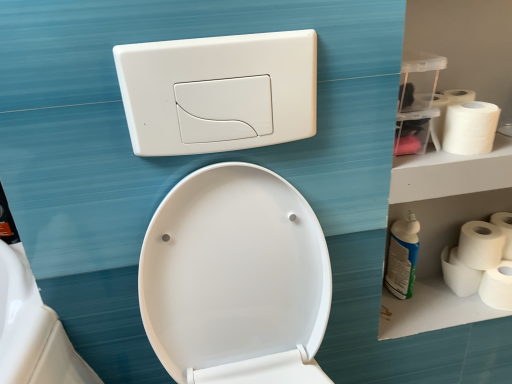
Identify the location of blue glossy spray bottle at right. The width and height of the screenshot is (512, 384). (402, 256).

This screenshot has width=512, height=384. Describe the element at coordinates (402, 256) in the screenshot. I see `blue glossy spray bottle at right` at that location.

Describe the element at coordinates (219, 92) in the screenshot. I see `white plastic flush plate at upper center` at that location.

Measure the distance between point (507, 238) and camera.

Point (507, 238) is 1.09 meters from camera.

The height and width of the screenshot is (384, 512). What do you see at coordinates (504, 231) in the screenshot? I see `white matte toilet paper at right, the 2th toilet paper viewed from the top` at bounding box center [504, 231].

In order to face white matte toilet paper at right, the first toilet paper in the bottom-to-top sequence, should I rotate leftwards or rightwards?

Turn right approximately 30.557 degrees to face it.

What do you see at coordinates (470, 128) in the screenshot?
I see `white matte toilet paper at right, positioned as the first toilet paper in top-to-bottom order` at bounding box center [470, 128].

Measure the distance between white matte toilet paper at right, the second toilet paper ordered from the bottom, and camera.

1.13 meters.

Identify the location of blue glossy spray bottle at right. (402, 256).

Is white plastic flush plate at upper center a part of white matte toilet paper at right, the first toilet paper in the bottom-to-top sequence?

No, white plastic flush plate at upper center is not inside white matte toilet paper at right, the first toilet paper in the bottom-to-top sequence.

From a real-world perspective, is white matte toilet paper at right, the first toilet paper in the bottom-to-top sequence, physically located above or below white plastic flush plate at upper center?

white matte toilet paper at right, the first toilet paper in the bottom-to-top sequence, is below white plastic flush plate at upper center.

Is white matte toilet paper at right, which ranks as the fifth toilet paper in top-to-bottom order, thinner than white plastic flush plate at upper center?

Incorrect, the width of white matte toilet paper at right, which ranks as the fifth toilet paper in top-to-bottom order, is not less than that of white plastic flush plate at upper center.

Which object is wider, blue glossy spray bottle at right or white matte toilet paper at right, positioned as the first toilet paper in top-to-bottom order?

white matte toilet paper at right, positioned as the first toilet paper in top-to-bottom order, is wider.

Considering the relative positions of blue glossy spray bottle at right and white matte toilet paper at right, positioned as the first toilet paper in top-to-bottom order, in the image provided, is blue glossy spray bottle at right to the left of white matte toilet paper at right, positioned as the first toilet paper in top-to-bottom order, from the viewer's perspective?

Yes.

Considering the sizes of objects blue glossy spray bottle at right and white matte toilet paper at right, positioned as the first toilet paper in top-to-bottom order, in the image provided, who is shorter, blue glossy spray bottle at right or white matte toilet paper at right, positioned as the first toilet paper in top-to-bottom order,?

Standing shorter between the two is white matte toilet paper at right, positioned as the first toilet paper in top-to-bottom order.

Does white matte toilet paper at right, which ranks as the fifth toilet paper in top-to-bottom order, have a smaller size compared to white matte toilet paper at right, placed as the third toilet paper when sorted from bottom to top?

Yes.

From the image's perspective, between white matte toilet paper at right, the first toilet paper in the bottom-to-top sequence, and white matte toilet paper at right, which appears as the third toilet paper when viewed from the top, who is located below?

white matte toilet paper at right, the first toilet paper in the bottom-to-top sequence.

How far apart are white matte toilet paper at right, which ranks as the fifth toilet paper in top-to-bottom order, and white matte toilet paper at right, which appears as the third toilet paper when viewed from the top?

A distance of 2.50 inches exists between white matte toilet paper at right, which ranks as the fifth toilet paper in top-to-bottom order, and white matte toilet paper at right, which appears as the third toilet paper when viewed from the top.

Can you tell me how much white matte toilet paper at right, the first toilet paper in the bottom-to-top sequence, and white matte toilet paper at right, which appears as the third toilet paper when viewed from the top, differ in facing direction?

0.000641 degrees separate the facing orientations of white matte toilet paper at right, the first toilet paper in the bottom-to-top sequence, and white matte toilet paper at right, which appears as the third toilet paper when viewed from the top.

Is blue glossy spray bottle at right far from white plastic flush plate at upper center?

They are positioned close to each other.

Looking at this image, what's the angular difference between blue glossy spray bottle at right and white plastic flush plate at upper center's facing directions?

blue glossy spray bottle at right and white plastic flush plate at upper center are facing 1.42 degrees away from each other.

Which is more to the right, blue glossy spray bottle at right or white plastic flush plate at upper center?

Positioned to the right is blue glossy spray bottle at right.

Relative to white plastic flush plate at upper center, is blue glossy spray bottle at right in front or behind?

blue glossy spray bottle at right is positioned farther from the viewer than white plastic flush plate at upper center.

Does white matte toilet paper at right, the 2th toilet paper viewed from the top, have a greater height compared to white matte toilet paper at right, positioned as the first toilet paper in top-to-bottom order?

Correct, white matte toilet paper at right, the 2th toilet paper viewed from the top, is much taller as white matte toilet paper at right, positioned as the first toilet paper in top-to-bottom order.

Can you confirm if white matte toilet paper at right, which is counted as the 4th toilet paper, starting from the bottom, is positioned to the right of white matte toilet paper at right, positioned as the fifth toilet paper in bottom-to-top order?

Correct, you'll find white matte toilet paper at right, which is counted as the 4th toilet paper, starting from the bottom, to the right of white matte toilet paper at right, positioned as the fifth toilet paper in bottom-to-top order.

From a real-world perspective, is white matte toilet paper at right, the 2th toilet paper viewed from the top, over white matte toilet paper at right, positioned as the first toilet paper in top-to-bottom order?

Actually, white matte toilet paper at right, the 2th toilet paper viewed from the top, is physically below white matte toilet paper at right, positioned as the first toilet paper in top-to-bottom order, in the real world.

Can you confirm if white matte toilet paper at right, which is counted as the 4th toilet paper, starting from the bottom, is smaller than white matte toilet paper at right, positioned as the first toilet paper in top-to-bottom order?

No.

Is white matte toilet paper at right, which is counted as the 4th toilet paper, starting from the bottom, located outside white matte toilet paper at right, which ranks as the fifth toilet paper in top-to-bottom order?

Indeed, white matte toilet paper at right, which is counted as the 4th toilet paper, starting from the bottom, is completely outside white matte toilet paper at right, which ranks as the fifth toilet paper in top-to-bottom order.

Is white matte toilet paper at right, which is counted as the 4th toilet paper, starting from the bottom, not near white matte toilet paper at right, which ranks as the fifth toilet paper in top-to-bottom order?

No, white matte toilet paper at right, which is counted as the 4th toilet paper, starting from the bottom, is not far from white matte toilet paper at right, which ranks as the fifth toilet paper in top-to-bottom order.

Considering the relative sizes of white matte toilet paper at right, which is counted as the 4th toilet paper, starting from the bottom, and white matte toilet paper at right, the first toilet paper in the bottom-to-top sequence, in the image provided, is white matte toilet paper at right, which is counted as the 4th toilet paper, starting from the bottom, thinner than white matte toilet paper at right, the first toilet paper in the bottom-to-top sequence,?

In fact, white matte toilet paper at right, which is counted as the 4th toilet paper, starting from the bottom, might be wider than white matte toilet paper at right, the first toilet paper in the bottom-to-top sequence.

Considering the relative sizes of white matte toilet paper at right, the 2th toilet paper viewed from the top, and white matte toilet paper at right, which ranks as the fifth toilet paper in top-to-bottom order, in the image provided, is white matte toilet paper at right, the 2th toilet paper viewed from the top, taller than white matte toilet paper at right, which ranks as the fifth toilet paper in top-to-bottom order,?

Yes, white matte toilet paper at right, the 2th toilet paper viewed from the top, is taller than white matte toilet paper at right, which ranks as the fifth toilet paper in top-to-bottom order.

Who is taller, white matte toilet paper at right, which appears as the third toilet paper when viewed from the top, or white matte toilet paper at right, which ranks as the fifth toilet paper in top-to-bottom order?

white matte toilet paper at right, which appears as the third toilet paper when viewed from the top.

From the picture: From the image's perspective, is white matte toilet paper at right, which appears as the third toilet paper when viewed from the top, located above or below white matte toilet paper at right, the first toilet paper in the bottom-to-top sequence?

Based on their image positions, white matte toilet paper at right, which appears as the third toilet paper when viewed from the top, is located above white matte toilet paper at right, the first toilet paper in the bottom-to-top sequence.

Would you say white matte toilet paper at right, which appears as the third toilet paper when viewed from the top, is outside white matte toilet paper at right, the first toilet paper in the bottom-to-top sequence?

That's correct, white matte toilet paper at right, which appears as the third toilet paper when viewed from the top, is outside of white matte toilet paper at right, the first toilet paper in the bottom-to-top sequence.

From the image's perspective, count 5th toilet papers downward from the white plastic flush plate at upper center and point to it. Please provide its 2D coordinates.

[(497, 286)]

The height and width of the screenshot is (384, 512). I want to click on toilet paper that appears in front of the blue glossy spray bottle at right, so click(x=470, y=128).

Looking at the image, which one is located closer to white matte toilet paper at right, which is counted as the 4th toilet paper, starting from the bottom, white matte toilet paper at right, which appears as the third toilet paper when viewed from the top, or white matte toilet paper at right, the second toilet paper ordered from the bottom?

white matte toilet paper at right, which appears as the third toilet paper when viewed from the top, lies closer to white matte toilet paper at right, which is counted as the 4th toilet paper, starting from the bottom, than the other object.

When comparing their distances from white matte toilet paper at right, which is counted as the 4th toilet paper, starting from the bottom, does white plastic flush plate at upper center or white matte toilet paper at right, positioned as the fifth toilet paper in bottom-to-top order, seem closer?

white matte toilet paper at right, positioned as the fifth toilet paper in bottom-to-top order.

Considering their positions, is white matte toilet paper at right, the first toilet paper in the bottom-to-top sequence, positioned closer to white matte toilet paper at right, which appears as the third toilet paper when viewed from the top, than white matte toilet paper at right, the second toilet paper ordered from the bottom?

The object closer to white matte toilet paper at right, which appears as the third toilet paper when viewed from the top, is white matte toilet paper at right, the second toilet paper ordered from the bottom.

Consider the image. Considering their positions, is white matte toilet paper at right, the 2th toilet paper viewed from the top, positioned closer to blue glossy spray bottle at right than white plastic flush plate at upper center?

white matte toilet paper at right, the 2th toilet paper viewed from the top, lies closer to blue glossy spray bottle at right than the other object.

In the scene shown: Considering their positions, is white matte toilet paper at right, arranged as the 4th toilet paper when viewed from the top, positioned further to blue glossy spray bottle at right than white matte toilet paper at right, the first toilet paper in the bottom-to-top sequence?

The object further to blue glossy spray bottle at right is white matte toilet paper at right, the first toilet paper in the bottom-to-top sequence.

Which object lies further to the anchor point white plastic flush plate at upper center, white matte toilet paper at right, arranged as the 4th toilet paper when viewed from the top, or white matte toilet paper at right, placed as the third toilet paper when sorted from bottom to top?

Among the two, white matte toilet paper at right, arranged as the 4th toilet paper when viewed from the top, is located further to white plastic flush plate at upper center.

Estimate the real-world distances between objects in this image. Which object is closer to white matte toilet paper at right, positioned as the fifth toilet paper in bottom-to-top order, white matte toilet paper at right, the 2th toilet paper viewed from the top, or white matte toilet paper at right, placed as the third toilet paper when sorted from bottom to top?

Among the two, white matte toilet paper at right, placed as the third toilet paper when sorted from bottom to top, is located nearer to white matte toilet paper at right, positioned as the fifth toilet paper in bottom-to-top order.

Estimate the real-world distances between objects in this image. Which object is closer to white matte toilet paper at right, placed as the third toilet paper when sorted from bottom to top, blue glossy spray bottle at right or white matte toilet paper at right, arranged as the 4th toilet paper when viewed from the top?

Based on the image, white matte toilet paper at right, arranged as the 4th toilet paper when viewed from the top, appears to be nearer to white matte toilet paper at right, placed as the third toilet paper when sorted from bottom to top.

Find the location of a particular element. The image size is (512, 384). cleaning product between white matte toilet paper at right, positioned as the first toilet paper in top-to-bottom order, and white matte toilet paper at right, which ranks as the fifth toilet paper in top-to-bottom order, in the vertical direction is located at coordinates (402, 256).

Identify the location of cleaning product between white plastic flush plate at upper center and white matte toilet paper at right, the second toilet paper ordered from the bottom, from left to right. This screenshot has height=384, width=512. (402, 256).

Find the location of a particular element. The image size is (512, 384). toilet paper between white plastic flush plate at upper center and white matte toilet paper at right, the second toilet paper ordered from the bottom, from left to right is located at coordinates (470, 128).

Where is `cleaning product between white plastic flush plate at upper center and white matte toilet paper at right, which is counted as the 4th toilet paper, starting from the bottom, in the horizontal direction`? cleaning product between white plastic flush plate at upper center and white matte toilet paper at right, which is counted as the 4th toilet paper, starting from the bottom, in the horizontal direction is located at coordinates (402, 256).